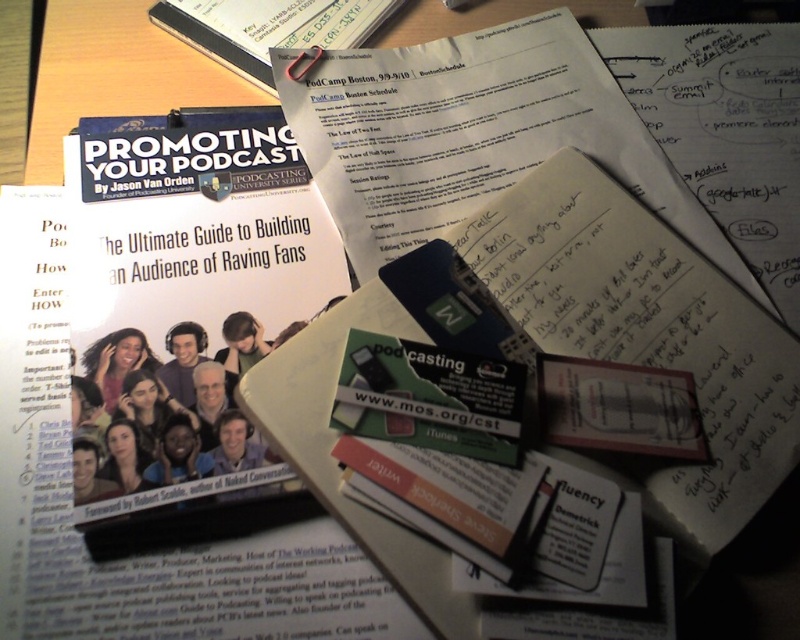
Question: Among these points, which one is farthest from the camera?

Choices:
 (A) (220, 60)
 (B) (472, 96)

Answer: (A)

Question: Is white paper at center above matte black book at upper center?

Choices:
 (A) yes
 (B) no

Answer: (B)

Question: Which point appears farthest from the camera in this image?

Choices:
 (A) (742, 262)
 (B) (202, 10)

Answer: (B)

Question: In this image, where is white paper at center located relative to matte black book at upper center?

Choices:
 (A) right
 (B) left

Answer: (A)

Question: Can you confirm if white paper at center is smaller than matte black book at upper center?

Choices:
 (A) no
 (B) yes

Answer: (A)

Question: Which object appears farthest from the camera in this image?

Choices:
 (A) matte black book at upper center
 (B) white paper at center

Answer: (A)